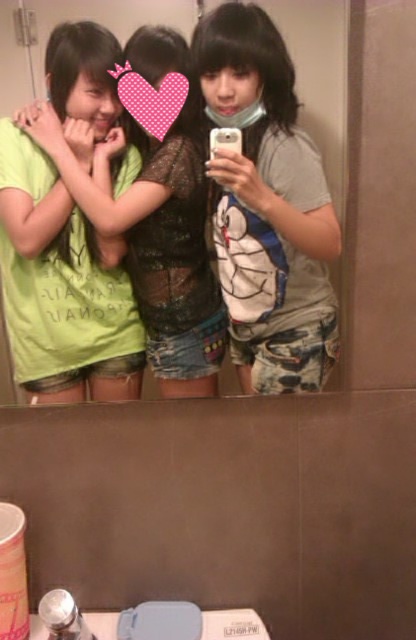
Is matte gray t-shirt at center smaller than green matte t-shirt at center?

Correct, matte gray t-shirt at center occupies less space than green matte t-shirt at center.

Is matte gray t-shirt at center bigger than green matte t-shirt at center?

No.

Between point (227, 84) and point (54, 136), which one is positioned behind?

Point (54, 136)

Locate an element on the screen. matte gray t-shirt at center is located at coordinates (267, 205).